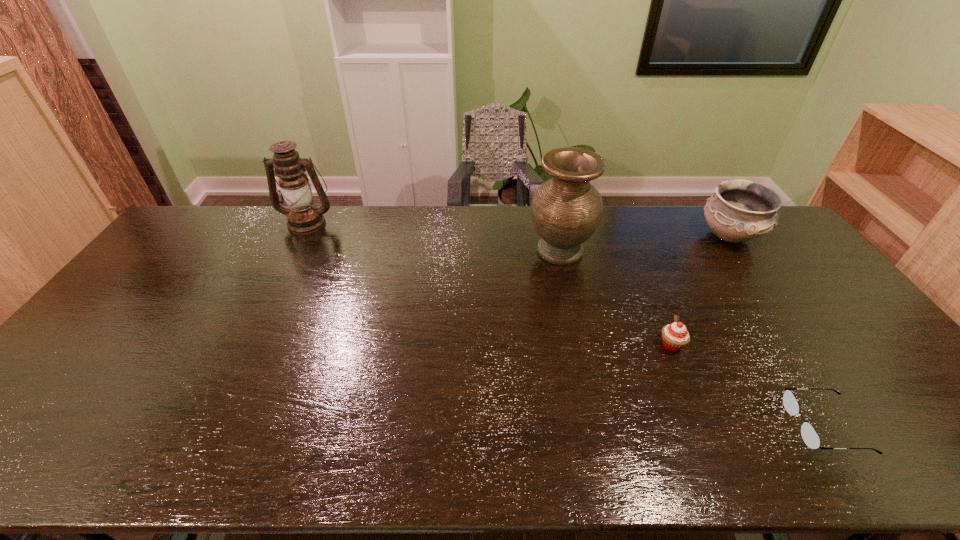
The height and width of the screenshot is (540, 960). I want to click on vacant space located 0.140m on the front of the second shortest object, so click(x=695, y=402).

The width and height of the screenshot is (960, 540). What are the coordinates of `vacant position located on the lenses of the nearest object` in the screenshot? It's located at coord(729,425).

The height and width of the screenshot is (540, 960). Identify the location of vacant space located 0.140m on the lenses of the nearest object. (732, 425).

In order to click on free space located 0.380m on the lenses of the nearest object in this screenshot , I will do `click(629, 425)`.

Identify the location of vase located at the far edge. Image resolution: width=960 pixels, height=540 pixels. pos(566,210).

The image size is (960, 540). I want to click on lantern located at the far edge, so click(303, 218).

This screenshot has height=540, width=960. Find the location of `pottery at the far edge`. pottery at the far edge is located at coordinates (740, 210).

Locate an element on the screen. object positioned at the near edge is located at coordinates (809, 435).

You are a GUI agent. You are given a task and a screenshot of the screen. Output one action in this format:
    pyautogui.click(x=<x>, y=<y>)
    Task: Click on the object present at the right edge
    
    Given the screenshot: What is the action you would take?
    pyautogui.click(x=740, y=210)

In order to click on object positioned at the far right corner in this screenshot , I will do `click(740, 210)`.